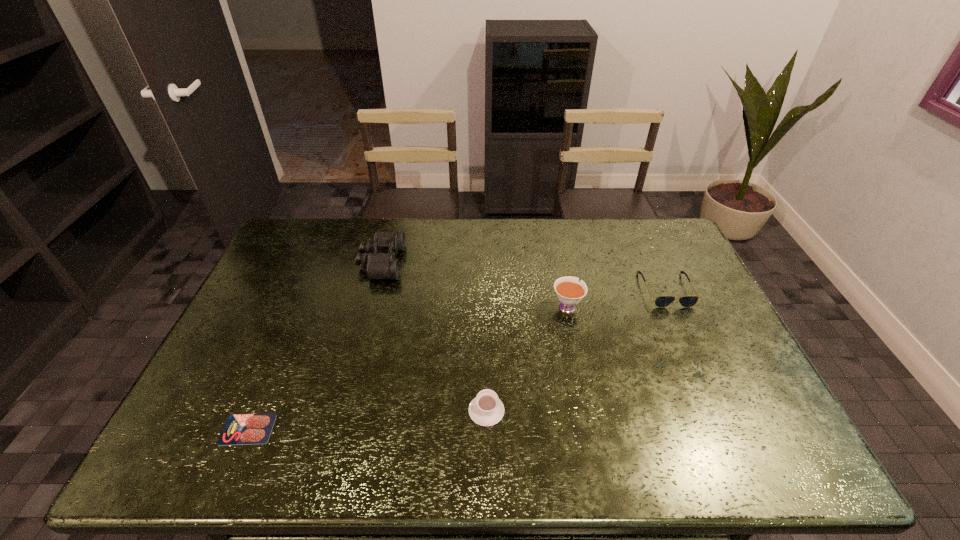
Locate an element on the screen. free point that satisfies the following two spatial constraints: 1. on the handle side of the left teacup; 2. at the eyepieces of the binoculars is located at coordinates (485, 262).

Image resolution: width=960 pixels, height=540 pixels. Identify the location of free space in the image that satisfies the following two spatial constraints: 1. at the eyepieces of the binoculars; 2. on the handle side of the shorter teacup. (343, 410).